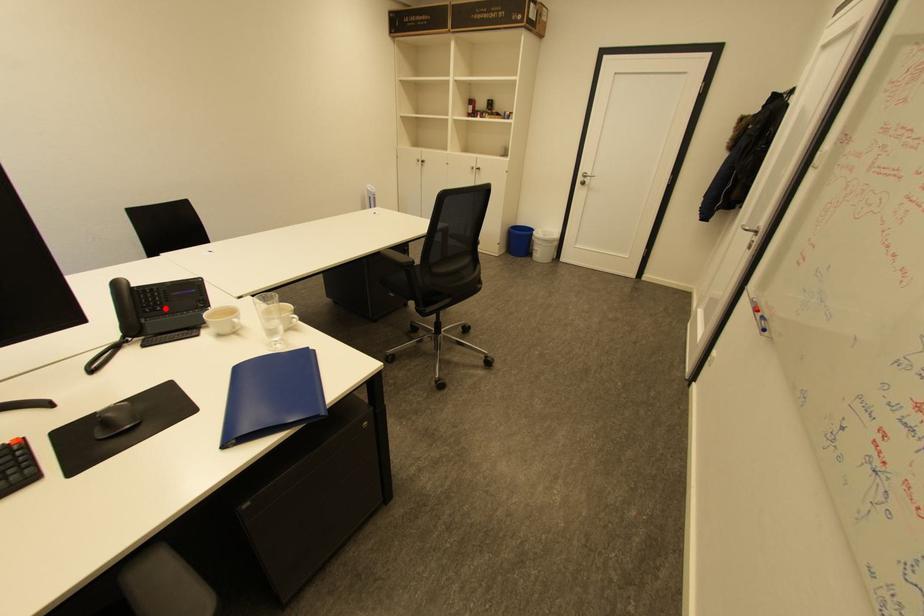
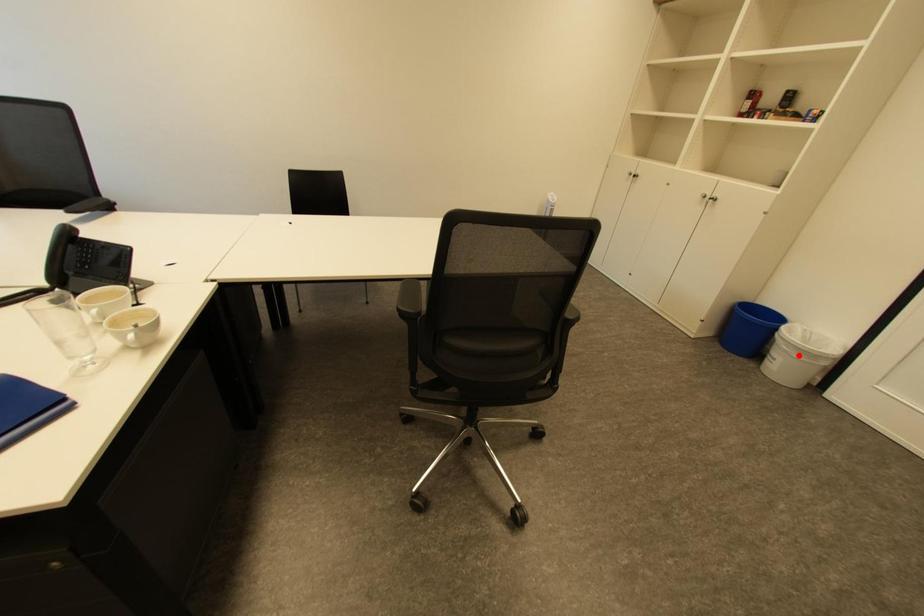
I am providing you with two images of the same scene from different viewpoints. A red point is marked on the first image and another point is marked on the second image. Are the points marked in image1 and image2 representing the same 3D position?

No